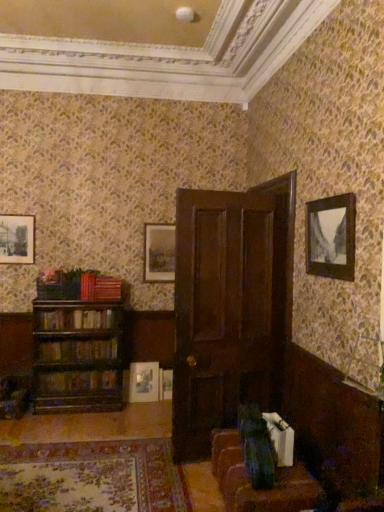
This screenshot has width=384, height=512. What are the coordinates of `vacant region to the left of dark wood door at center` in the screenshot? It's located at (147, 459).